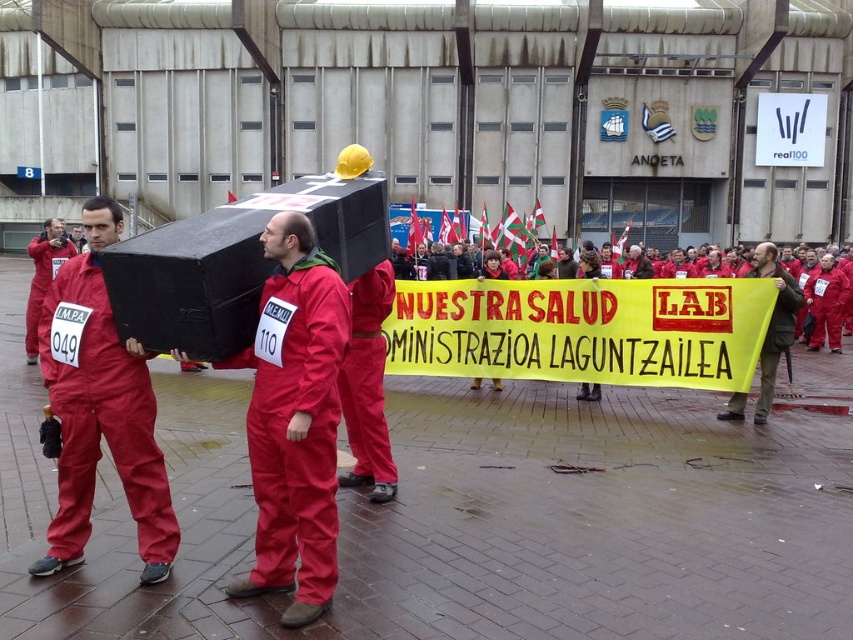
Question: Which of these objects is positioned farthest from the red fabric banner at center?

Choices:
 (A) matte red jumpsuit at center
 (B) matte red jumpsuit at left

Answer: (B)

Question: Does matte red jumpsuit at center have a smaller size compared to red fabric banner at center?

Choices:
 (A) no
 (B) yes

Answer: (B)

Question: Is matte red jumpsuit at center to the left of matte red jumpsuit at left from the viewer's perspective?

Choices:
 (A) yes
 (B) no

Answer: (B)

Question: Which is nearer to the matte red jumpsuit at left?

Choices:
 (A) matte red jumpsuit at center
 (B) red fabric banner at center

Answer: (B)

Question: Among these points, which one is nearest to the camera?

Choices:
 (A) (763, 272)
 (B) (35, 356)

Answer: (A)

Question: Is the position of matte red jumpsuit at center less distant than that of matte red jumpsuit at left?

Choices:
 (A) yes
 (B) no

Answer: (A)